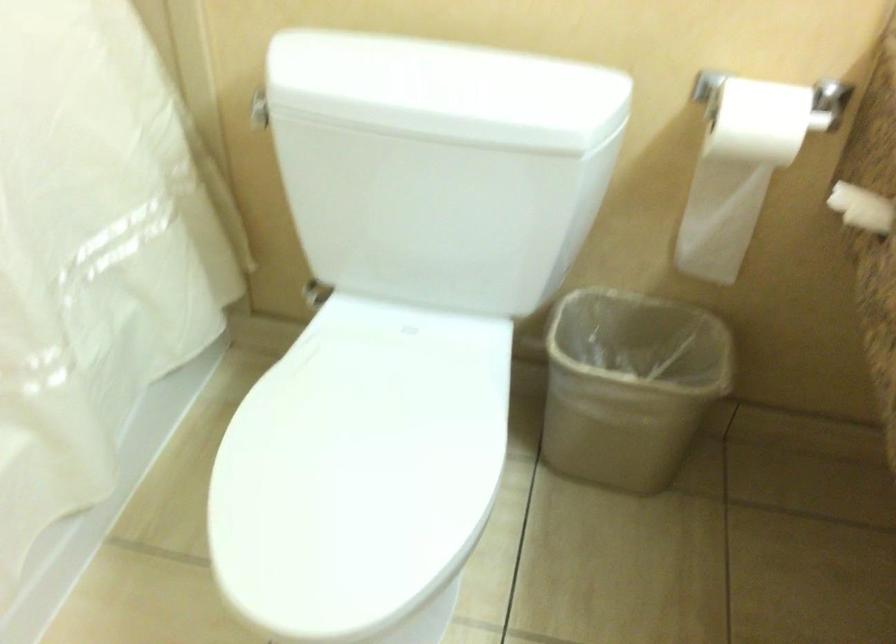
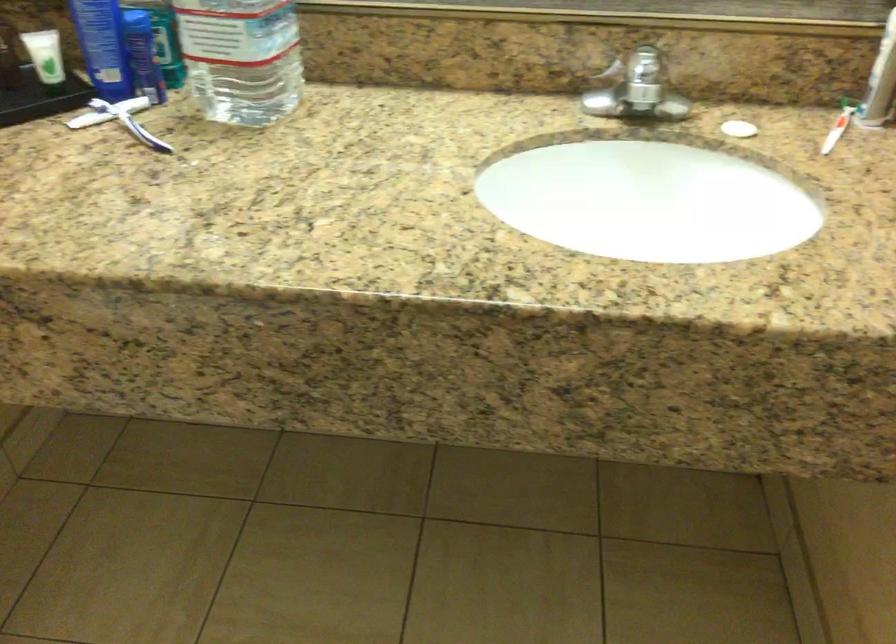
Based on the continuous images, in which direction is the camera rotating?

The camera's rotation is toward right-down.